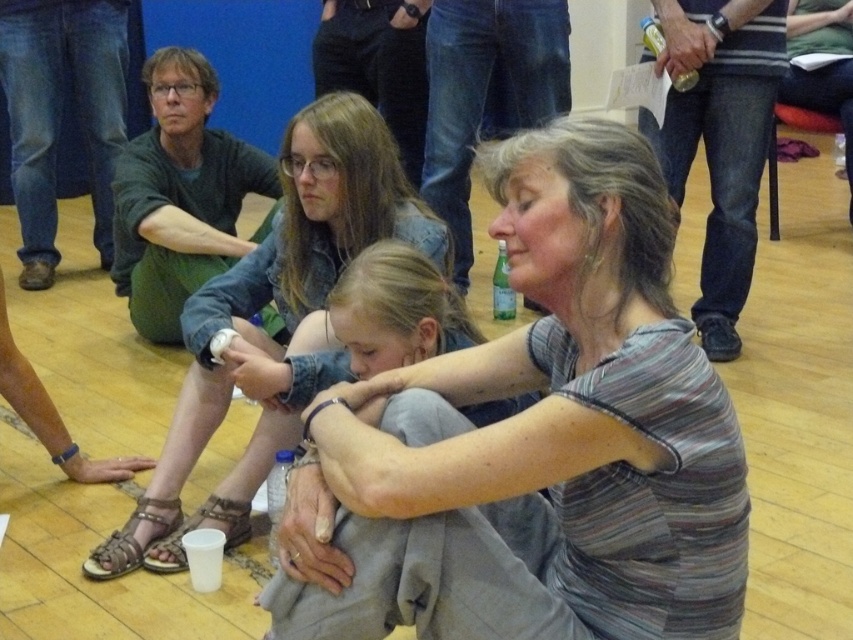
You are a photographer trying to capture a candid shot of the striped cotton shirt at center and the matte denim jacket at center. Since you want to ensure both are clearly visible in the frame, which object should you focus on first considering their heights?

The striped cotton shirt at center has a lesser height compared to matte denim jacket at center, so you should focus on the striped cotton shirt at center first to ensure it is in clear view before adjusting for the taller matte denim jacket at center.

You are standing at the entrance of the room and want to find the striped cotton shirt at center. According to the spatial coordinates provided, in which direction should you look to locate it?

The striped cotton shirt at center is located at point coordinates 0.688 on the x axis and 0.632 on the y axis. Since the coordinate system starts at the bottom left corner, you should look towards the upper right direction to find it.